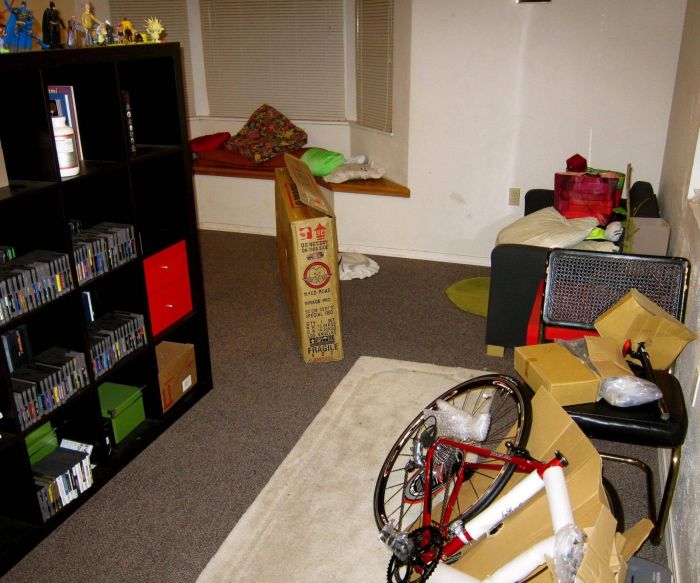
Find the location of a particular element. The height and width of the screenshot is (583, 700). cardboard boxes is located at coordinates (308, 275), (578, 375), (582, 505), (181, 377).